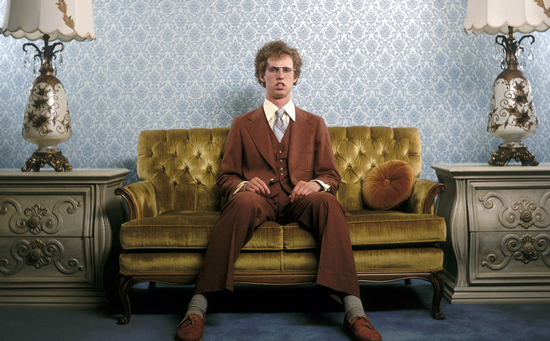
Find the location of a particular element. The image size is (550, 341). sofa is located at coordinates (168, 197).